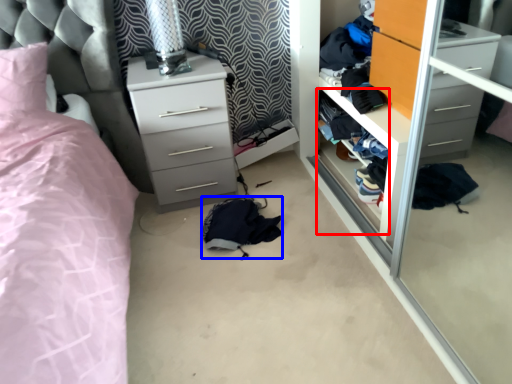
Question: Which object is further to the camera taking this photo, shelf (highlighted by a red box) or clothing (highlighted by a blue box)?

Choices:
 (A) shelf
 (B) clothing

Answer: (B)